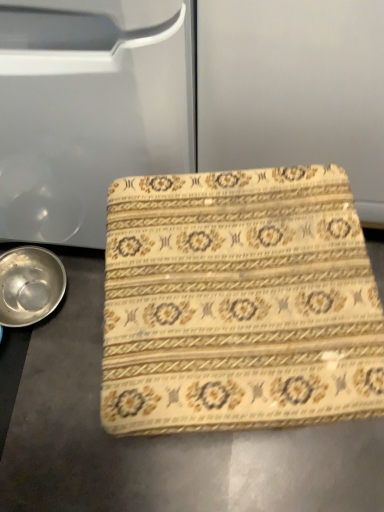
At what (x,y) coordinates should I click in order to perform the action: click on empty space that is ontop of beige floral fabric at center (from a real-world perspective). Please return your answer as a coordinate pair (x, y). The height and width of the screenshot is (512, 384). Looking at the image, I should click on (244, 284).